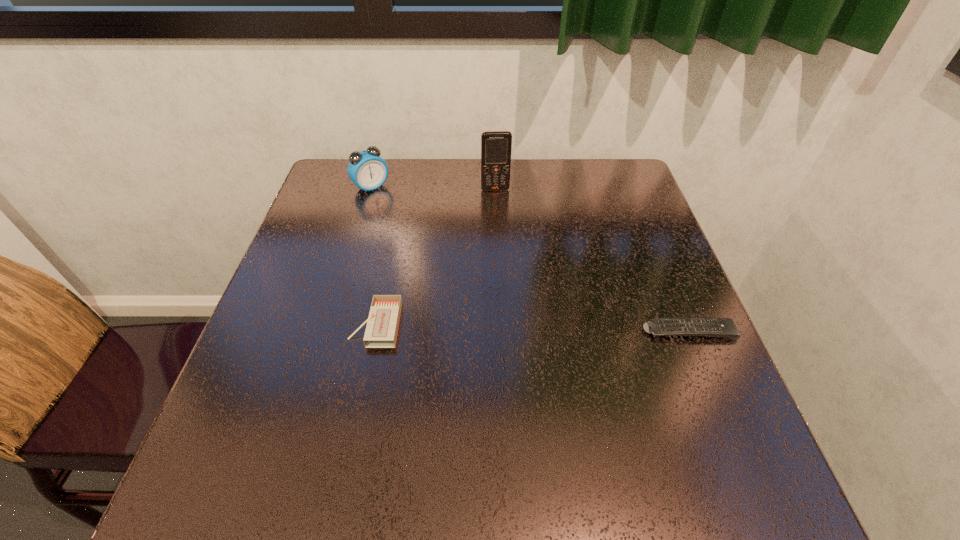
Where is `vacant area that lies between the third object from left to right and the matchbox`? The width and height of the screenshot is (960, 540). vacant area that lies between the third object from left to right and the matchbox is located at coordinates (435, 257).

The width and height of the screenshot is (960, 540). In order to click on vacant space in between the third object from left to right and the third tallest object in this screenshot , I will do [x=435, y=257].

You are a GUI agent. You are given a task and a screenshot of the screen. Output one action in this format:
    pyautogui.click(x=<x>, y=<y>)
    Task: Click on the free point between the alarm clock and the third object from left to right
    The image size is (960, 540).
    Given the screenshot: What is the action you would take?
    pyautogui.click(x=433, y=188)

Locate an element on the screen. vacant space that is in between the second shortest object and the tallest object is located at coordinates (435, 257).

You are a GUI agent. You are given a task and a screenshot of the screen. Output one action in this format:
    pyautogui.click(x=<x>, y=<y>)
    Task: Click on the free point between the third shortest object and the remote control
    
    Given the screenshot: What is the action you would take?
    pyautogui.click(x=530, y=259)

Locate an element on the screen. This screenshot has height=540, width=960. empty space between the alarm clock and the third tallest object is located at coordinates (373, 255).

I want to click on unoccupied area between the third shortest object and the third object from left to right, so click(x=433, y=188).

At what (x,y) coordinates should I click in order to perform the action: click on vacant area that lies between the cellular telephone and the second shortest object. Please return your answer as a coordinate pair (x, y). Looking at the image, I should click on (435, 257).

Where is `object that is the third closest to the alarm clock`? This screenshot has height=540, width=960. object that is the third closest to the alarm clock is located at coordinates (722, 327).

Point out which object is positioned as the second nearest to the second shortest object. Please provide its 2D coordinates. Your answer should be formatted as a tuple, i.e. [(x, y)], where the tuple contains the x and y coordinates of a point satisfying the conditions above.

[(496, 146)]